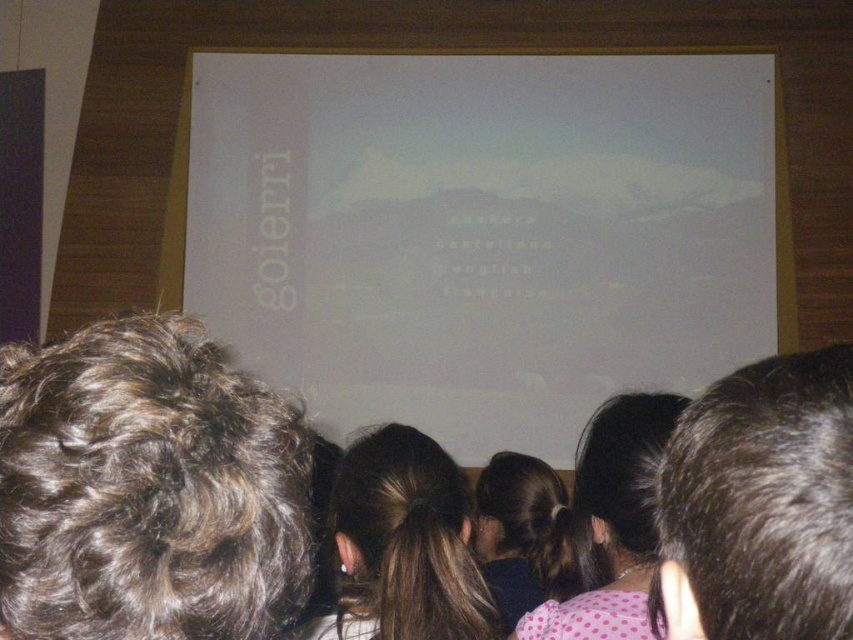
Consider the image. Is white matte projection screen at center to the left of pink dotted shirt at center from the viewer's perspective?

Yes, white matte projection screen at center is to the left of pink dotted shirt at center.

Who is shorter, white matte projection screen at center or pink dotted shirt at center?

With less height is pink dotted shirt at center.

Who is more forward, (453, 243) or (682, 404)?

Positioned in front is point (682, 404).

Image resolution: width=853 pixels, height=640 pixels. Identify the location of white matte projection screen at center. pyautogui.click(x=482, y=232).

Does white matte projection screen at center have a greater width compared to dark brown hair at center?

Correct, the width of white matte projection screen at center exceeds that of dark brown hair at center.

Is white matte projection screen at center shorter than dark brown hair at center?

In fact, white matte projection screen at center may be taller than dark brown hair at center.

Which is behind, point (183, 301) or point (346, 506)?

The point (183, 301) is more distant.

What are the coordinates of `white matte projection screen at center` in the screenshot? It's located at (482, 232).

What do you see at coordinates (148, 490) in the screenshot? Image resolution: width=853 pixels, height=640 pixels. I see `dark curly hair at upper left` at bounding box center [148, 490].

The image size is (853, 640). I want to click on dark curly hair at upper left, so [148, 490].